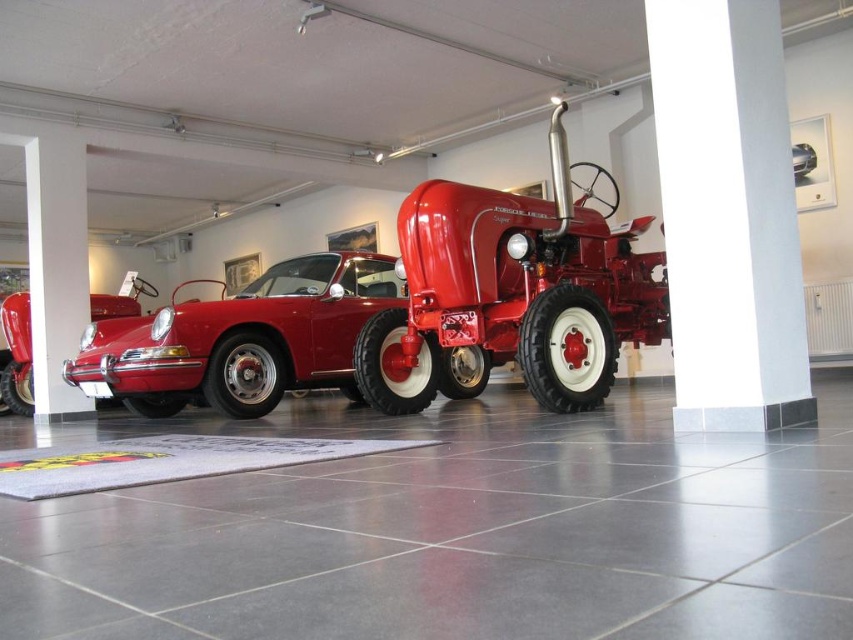
Based on the photo, does glossy red car at center have a smaller size compared to glossy metallic car at center?

No.

Who is more forward, (196, 307) or (801, 170)?

Point (196, 307) is in front.

Identify the location of glossy red car at center. This screenshot has height=640, width=853. (242, 339).

Between glossy red car at left and glossy metallic car at center, which one has more height?

Standing taller between the two is glossy red car at left.

Between glossy red car at left and glossy metallic car at center, which one is positioned lower?

Positioned lower is glossy red car at left.

The image size is (853, 640). I want to click on glossy red car at left, so click(x=16, y=353).

Does glossy red car at center lie in front of glossy red car at left?

Yes, it is.

Who is higher up, glossy red car at center or glossy red car at left?

glossy red car at center

Identify the location of glossy red car at center. (242, 339).